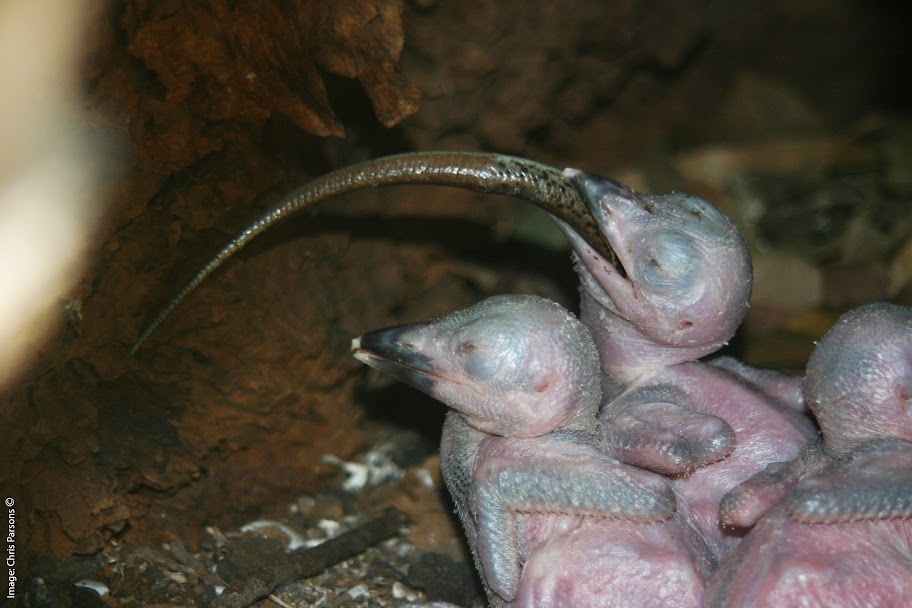
At what (x,y) coordinates should I click in order to perform the action: click on floor. Please return your answer as a coordinate pair (x, y). The image size is (912, 608). Looking at the image, I should click on (284, 422).